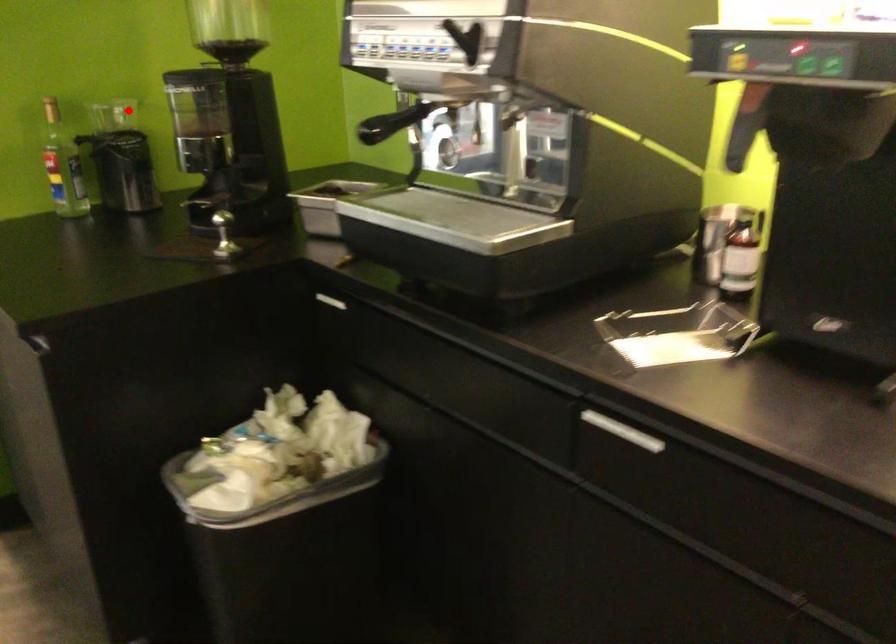
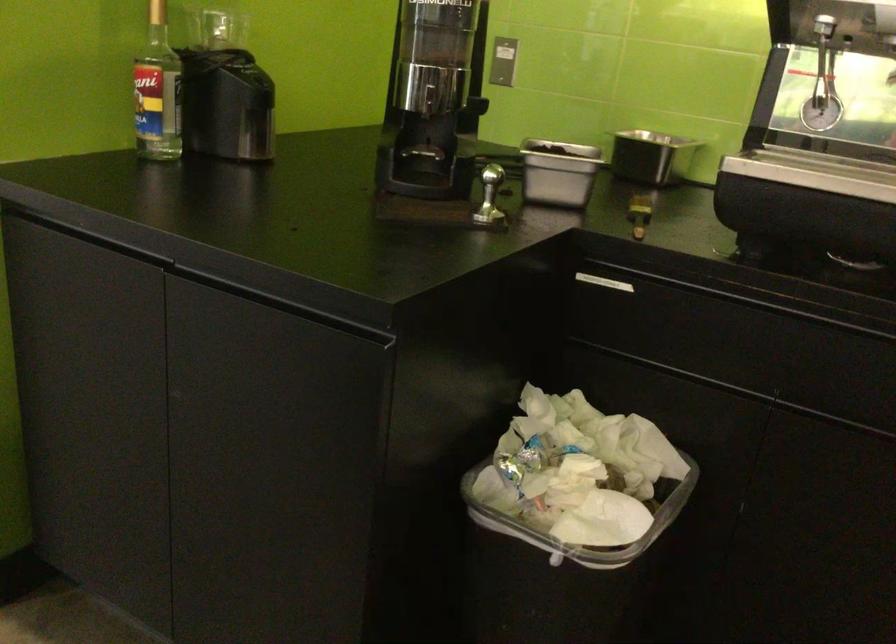
Question: I am providing you with two images of the same scene from different viewpoints. Given a red point in image1, look at the same physical point in image2. Is it:

Choices:
 (A) Closer to the viewpoint
 (B) Farther from the viewpoint

Answer: (A)